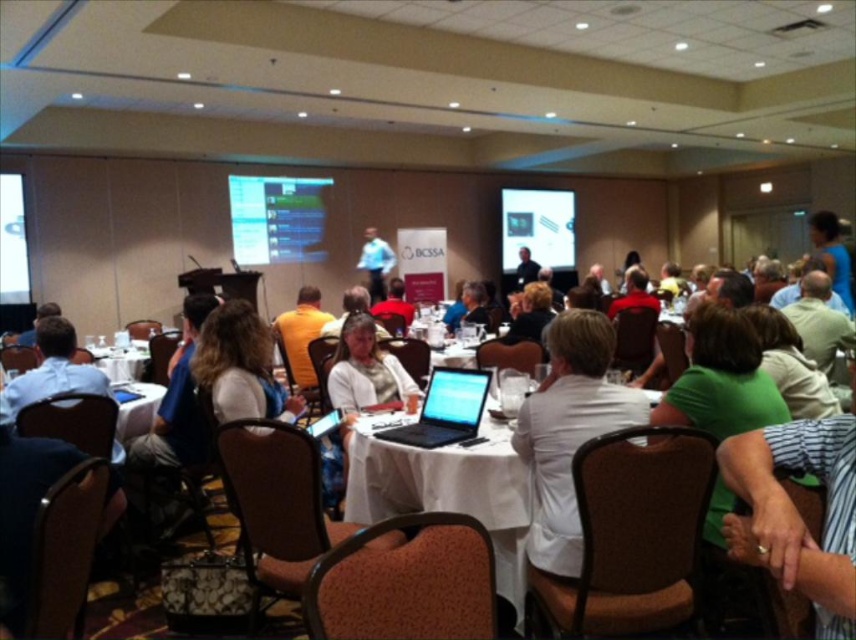
Does striped fabric shirt at lower right come behind blue shirt at center?

No, it is in front of blue shirt at center.

Does striped fabric shirt at lower right lie in front of blue shirt at center?

Yes, it is in front of blue shirt at center.

What do you see at coordinates (795, 509) in the screenshot? This screenshot has height=640, width=856. I see `striped fabric shirt at lower right` at bounding box center [795, 509].

This screenshot has width=856, height=640. I want to click on striped fabric shirt at lower right, so click(x=795, y=509).

Can you confirm if matte black projector screen at center is taller than blue shirt at center?

Yes.

Between point (568, 257) and point (373, 253), which one is positioned behind?

Point (568, 257)

In order to click on matte black projector screen at center in this screenshot , I will do `click(538, 227)`.

Which of these two, matte black laptop at center or blue shirt at center, stands taller?

Standing taller between the two is blue shirt at center.

Who is more distant from viewer, (461,384) or (366,250)?

Point (366,250)

Image resolution: width=856 pixels, height=640 pixels. In order to click on matte black laptop at center in this screenshot , I will do `click(455, 397)`.

Locate an element on the screen. matte black laptop at center is located at coordinates (455, 397).